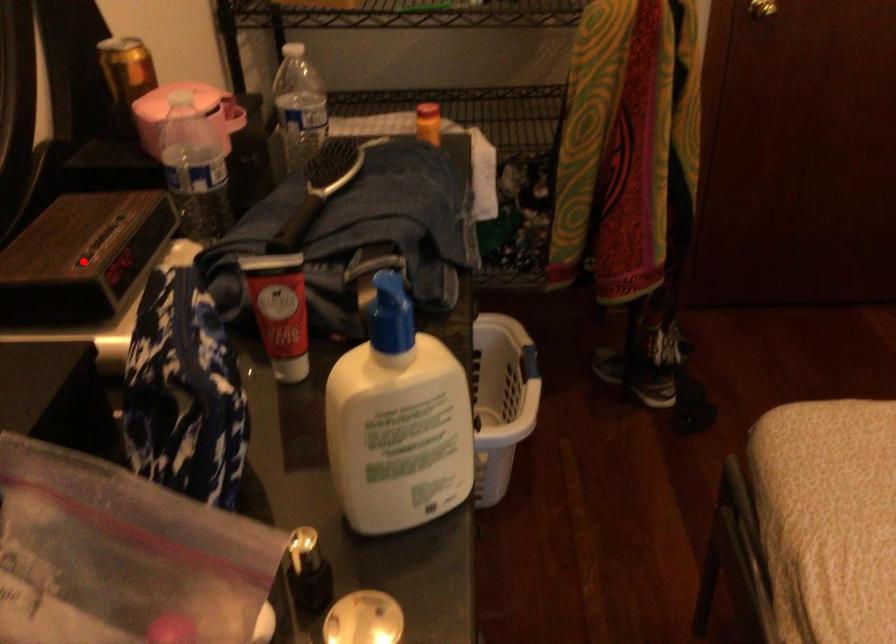
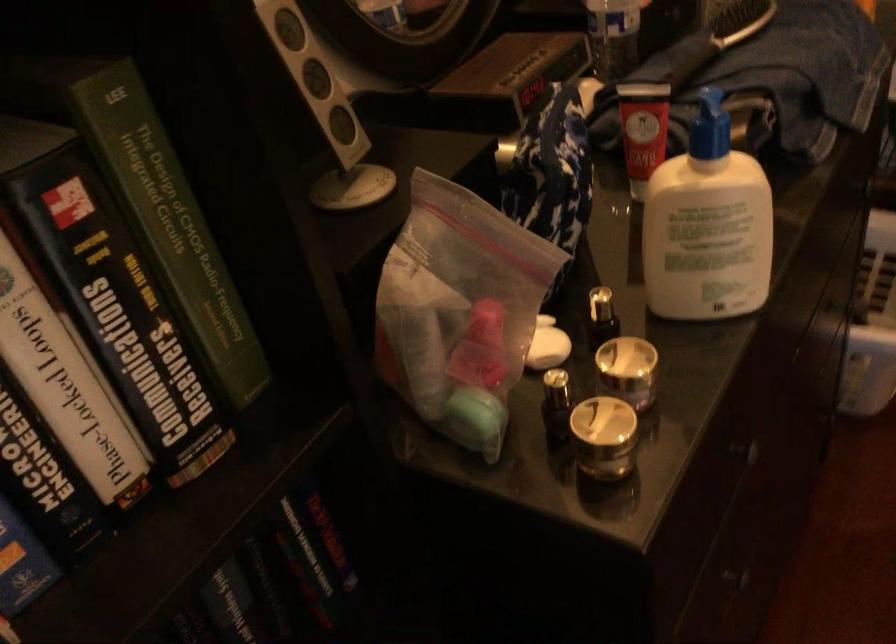
Question: A red point is marked in image1. In image2, is the corresponding 3D point closer to the camera or farther? Reply with the corresponding letter.

Choices:
 (A) The corresponding 3D point is closer.
 (B) The corresponding 3D point is farther.

Answer: (B)